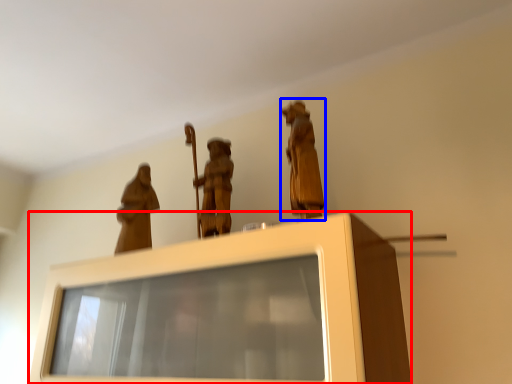
Question: Which object appears closest to the camera in this image, furniture (highlighted by a red box) or person (highlighted by a blue box)?

Choices:
 (A) furniture
 (B) person

Answer: (A)